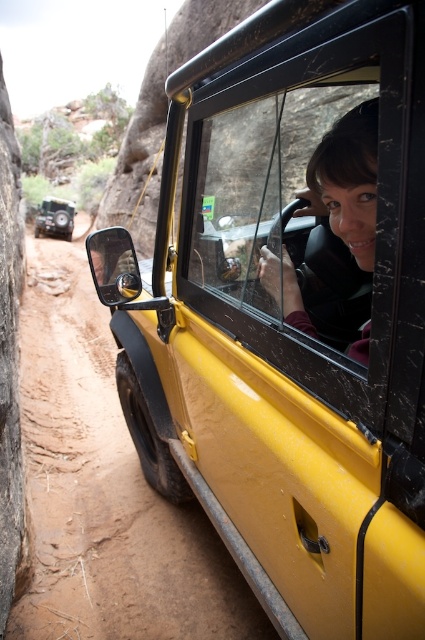
You are a passenger in the yellow Jeep and want to look out the clear glass window at center without moving your head. Can you see the matte black hair at center in your field of view?

The clear glass window at center is positioned on the left side of matte black hair at center, so if you are looking out the clear glass window at center, your field of view would include the matte black hair at center since it is to the right of the window.

You are standing outside the Jeep and want to see the driver through the clear glass window at center. Is the point at coordinates (274, 230) on the clear glass window at center visible to you?

Yes, the point at coordinates (274, 230) is on the clear glass window at center, so it is visible to you.

You are a passenger sitting in the back seat of the yellow Jeep. You want to see the driver without moving your head. Can you see the matte black hair at center through the clear glass window at center?

The clear glass window at center is in front of matte black hair at center, so yes, you can see the matte black hair at center through the clear glass window at center.